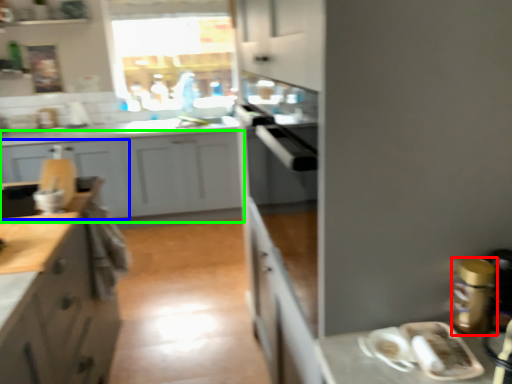
Question: Based on their relative distances, which object is farther from appliance (highlighted by a red box)? Choose from cabinetry (highlighted by a blue box) and cabinetry (highlighted by a green box).

Choices:
 (A) cabinetry
 (B) cabinetry

Answer: (A)